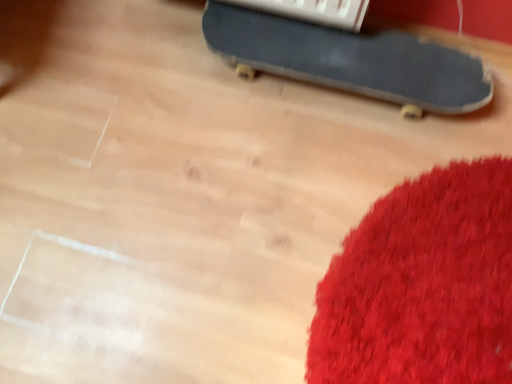
Find the location of a particular element. free space in front of smooth black skateboard at upper right is located at coordinates (335, 220).